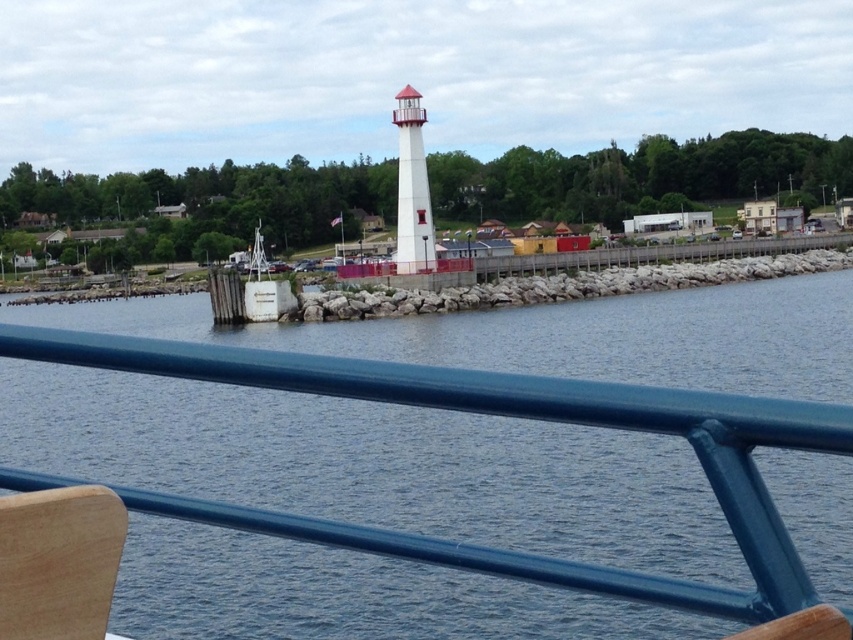
You are planning to place a small potted plant between the blue water at center and the wooden chair at lower left. Considering their sizes, which object should the plant be closer to?

The blue water at center is wider than the wooden chair at lower left, so the plant should be placed closer to the wooden chair at lower left to maintain balance.

You are a photographer setting up equipment at the waterfront scene. You have a blue water at center and a wooden chair at lower left in your viewfinder. Which object occupies more space in the frame?

The blue water at center has a larger size compared to the wooden chair at lower left, so it occupies more space in the frame.

You are standing on the wooden chair at lower left and looking towards the blue water at center. Which object is closer to you?

The wooden chair at lower left is closer to you because you are standing on it, while the blue water at center is further away.